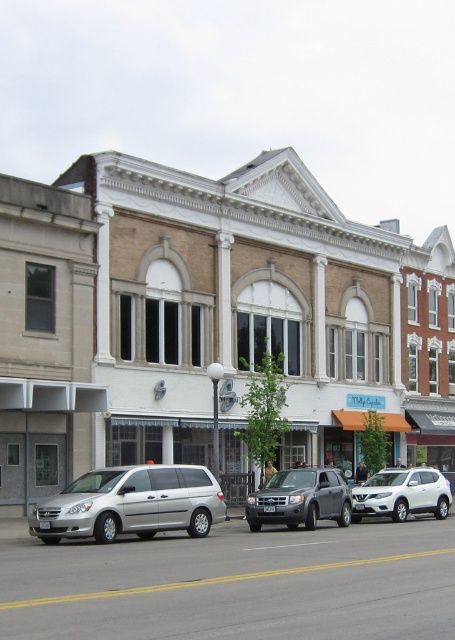
Is silver metallic van at center to the right of silver metallic minivan at lower left from the viewer's perspective?

Yes, silver metallic van at center is to the right of silver metallic minivan at lower left.

Who is higher up, silver metallic van at center or silver metallic minivan at lower left?

silver metallic van at center is higher up.

Does point (348, 433) come behind point (188, 477)?

Yes, point (348, 433) is farther from viewer.

You are a GUI agent. You are given a task and a screenshot of the screen. Output one action in this format:
    pyautogui.click(x=<x>, y=<y>)
    Task: Click on the silver metallic van at center
    
    Given the screenshot: What is the action you would take?
    pyautogui.click(x=210, y=321)

Is point (424, 440) closer to camera compared to point (293, 486)?

No.

Is silver metallic van at center shorter than satin silver suv at center?

Incorrect, silver metallic van at center's height does not fall short of satin silver suv at center's.

Image resolution: width=455 pixels, height=640 pixels. What are the coordinates of `silver metallic van at center` in the screenshot? It's located at (210, 321).

In the scene shown: Which is above, silver metallic minivan at lower left or white matte suv at center?

Positioned higher is silver metallic minivan at lower left.

Does silver metallic minivan at lower left have a larger size compared to white matte suv at center?

Incorrect, silver metallic minivan at lower left is not larger than white matte suv at center.

Locate an element on the screen. silver metallic minivan at lower left is located at coordinates (131, 502).